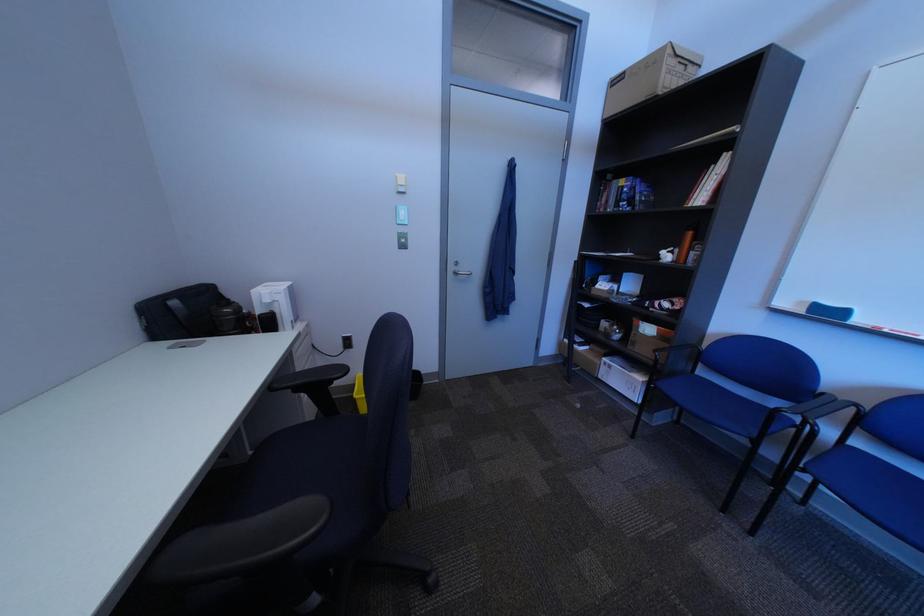
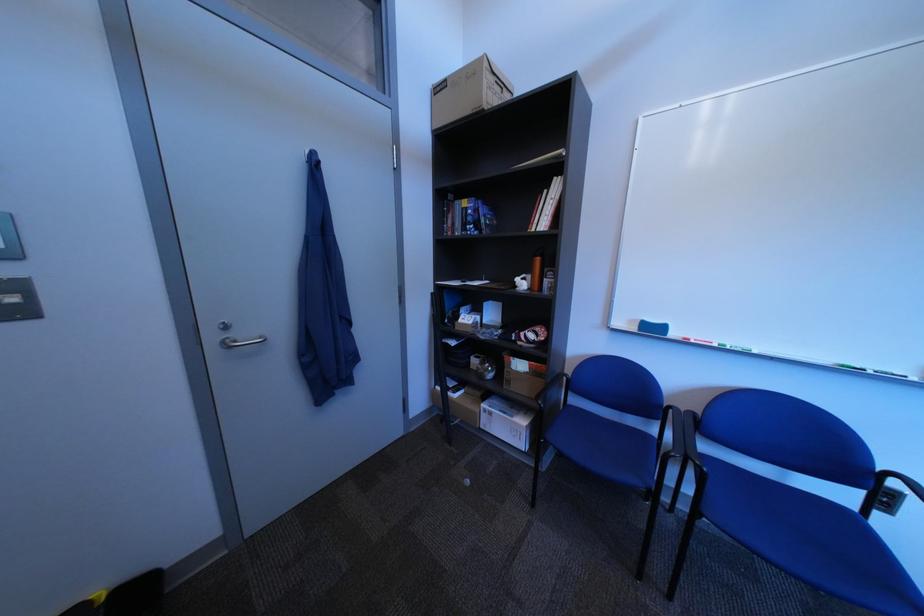
In the second image, find the point that corresponds to point (467, 270) in the first image.

(226, 339)